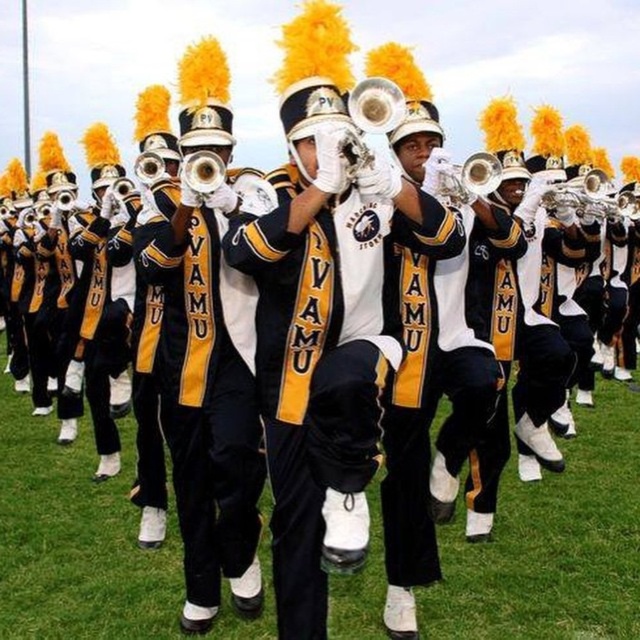
Question: Can you confirm if black matte uniform at center is smaller than matte brass trumpet at center?

Choices:
 (A) no
 (B) yes

Answer: (A)

Question: Can you confirm if black matte uniform at center is wider than matte brass trumpet at center?

Choices:
 (A) yes
 (B) no

Answer: (A)

Question: Which point is closer to the camera?

Choices:
 (A) matte brass trumpet at center
 (B) black matte uniform at center

Answer: (A)

Question: Is black matte uniform at center to the right of matte brass trumpet at center from the viewer's perspective?

Choices:
 (A) yes
 (B) no

Answer: (A)

Question: Which of the following is the farthest from the observer?

Choices:
 (A) black matte uniform at center
 (B) matte brass trumpet at center

Answer: (A)